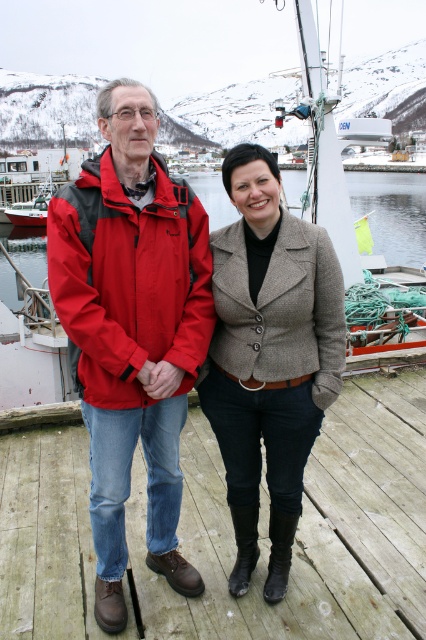
Looking at this image, who is higher up, red matte jacket at left or textured beige blazer at center?

Positioned higher is red matte jacket at left.

Who is more distant from viewer, [118,332] or [229,260]?

The point [229,260] is behind.

Where is `red matte jacket at left`? The image size is (426, 640). red matte jacket at left is located at coordinates [x=132, y=330].

From the picture: Does wooden at center have a smaller size compared to textured beige blazer at center?

Yes.

Between wooden at center and textured beige blazer at center, which one is positioned higher?

textured beige blazer at center is higher up.

Between point (304, 595) and point (215, 323), which one is positioned in front?

Positioned in front is point (304, 595).

Locate an element on the screen. This screenshot has height=640, width=426. wooden at center is located at coordinates (232, 532).

Is wooden at center bigger than red matte jacket at left?

No, wooden at center is not bigger than red matte jacket at left.

Can you confirm if wooden at center is smaller than red matte jacket at left?

Yes.

Between point (189, 483) and point (115, 492), which one is positioned behind?

Point (189, 483)

At what (x,y) coordinates should I click in order to perform the action: click on wooden at center. Please return your answer as a coordinate pair (x, y). Looking at the image, I should click on (232, 532).